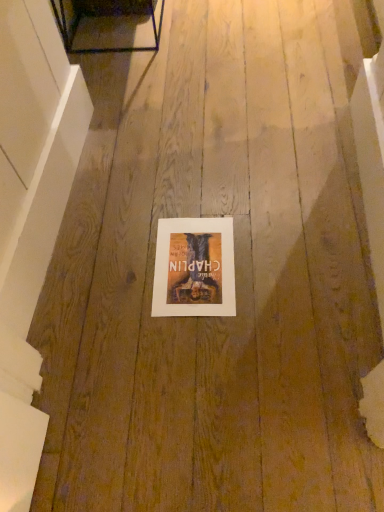
Image resolution: width=384 pixels, height=512 pixels. What do you see at coordinates (31, 216) in the screenshot? I see `white smooth wall at left` at bounding box center [31, 216].

The height and width of the screenshot is (512, 384). What are the coordinates of `white smooth wall at left` in the screenshot? It's located at (31, 216).

What is the approximate width of matte paper poster at center?

The width of matte paper poster at center is 12.09 inches.

You are a GUI agent. You are given a task and a screenshot of the screen. Output one action in this format:
    pyautogui.click(x=<x>, y=<y>)
    Task: Click on the matte paper poster at center
    The image size is (384, 512).
    Given the screenshot: What is the action you would take?
    pyautogui.click(x=194, y=268)

What do you see at coordinates (194, 268) in the screenshot? I see `matte paper poster at center` at bounding box center [194, 268].

Find the location of a particular element. The image size is (384, 512). white smooth wall at left is located at coordinates (31, 216).

Considering the relative positions of white smooth wall at left and matte paper poster at center in the image provided, is white smooth wall at left to the right of matte paper poster at center from the viewer's perspective?

In fact, white smooth wall at left is to the left of matte paper poster at center.

Is white smooth wall at left in front of matte paper poster at center?

Yes, white smooth wall at left is in front of matte paper poster at center.

Which is in front, point (25, 282) or point (158, 309)?

Positioned in front is point (25, 282).

From the image's perspective, which is above, white smooth wall at left or matte paper poster at center?

white smooth wall at left appears higher in the image.

From a real-world perspective, is white smooth wall at left positioned over matte paper poster at center based on gravity?

Yes, from a real-world perspective, white smooth wall at left is on top of matte paper poster at center.

Between white smooth wall at left and matte paper poster at center, which one has smaller width?

Thinner between the two is white smooth wall at left.

Does white smooth wall at left have a greater height compared to matte paper poster at center?

Indeed, white smooth wall at left has a greater height compared to matte paper poster at center.

Which of these two, white smooth wall at left or matte paper poster at center, is bigger?

Bigger between the two is white smooth wall at left.

Is white smooth wall at left situated inside matte paper poster at center or outside?

white smooth wall at left is outside matte paper poster at center.

Is white smooth wall at left positioned far away from matte paper poster at center?

No.

Is white smooth wall at left looking in the opposite direction of matte paper poster at center?

white smooth wall at left is not turned away from matte paper poster at center.

Can you tell me how much white smooth wall at left and matte paper poster at center differ in facing direction?

They differ by 91.2 degrees in their facing directions.

Locate an element on the screen. stairwell located on the left of matte paper poster at center is located at coordinates (31, 216).

Which is more to the left, matte paper poster at center or white smooth wall at left?

white smooth wall at left is more to the left.

Is the depth of matte paper poster at center greater than that of white smooth wall at left?

Yes.

Is point (230, 308) in front of point (52, 89)?

Yes, it is.

From the image's perspective, is matte paper poster at center over white smooth wall at left?

No.

From a real-world perspective, which object rests below the other?

matte paper poster at center.

Can you confirm if matte paper poster at center is wider than white smooth wall at left?

Indeed, matte paper poster at center has a greater width compared to white smooth wall at left.

Is matte paper poster at center shorter than white smooth wall at left?

Yes.

Who is smaller, matte paper poster at center or white smooth wall at left?

With smaller size is matte paper poster at center.

Is matte paper poster at center spatially inside white smooth wall at left, or outside of it?

matte paper poster at center exists outside the volume of white smooth wall at left.

Is matte paper poster at center not close to white smooth wall at left?

Actually, matte paper poster at center and white smooth wall at left are a little close together.

Is matte paper poster at center facing towards white smooth wall at left?

No, matte paper poster at center is not turned towards white smooth wall at left.

This screenshot has height=512, width=384. Find the location of `stairwell on the left of matte paper poster at center`. stairwell on the left of matte paper poster at center is located at coordinates (31, 216).

Identify the location of stairwell lying on the left of matte paper poster at center. (31, 216).

Where is `stairwell located above the matte paper poster at center (from the image's perspective)`? Image resolution: width=384 pixels, height=512 pixels. stairwell located above the matte paper poster at center (from the image's perspective) is located at coordinates (31, 216).